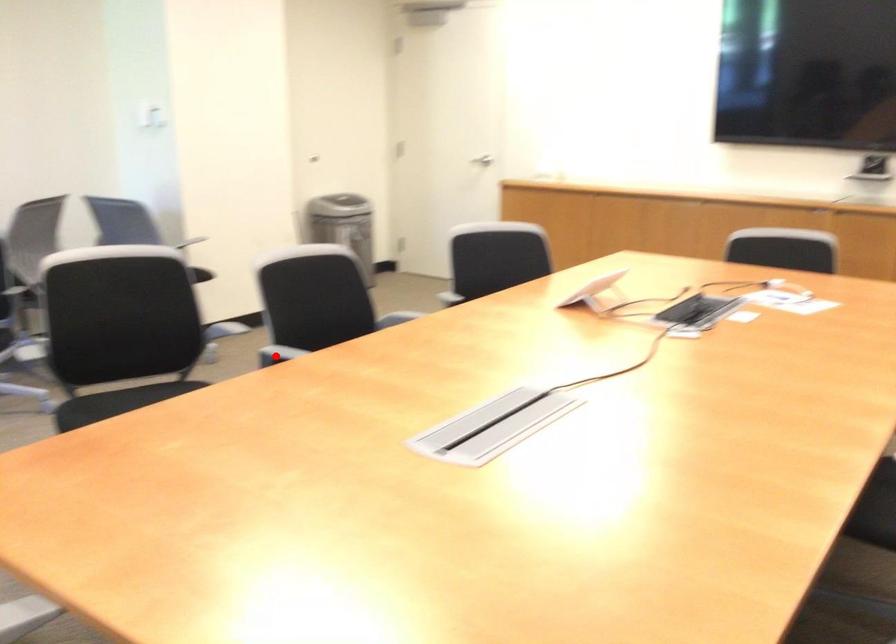
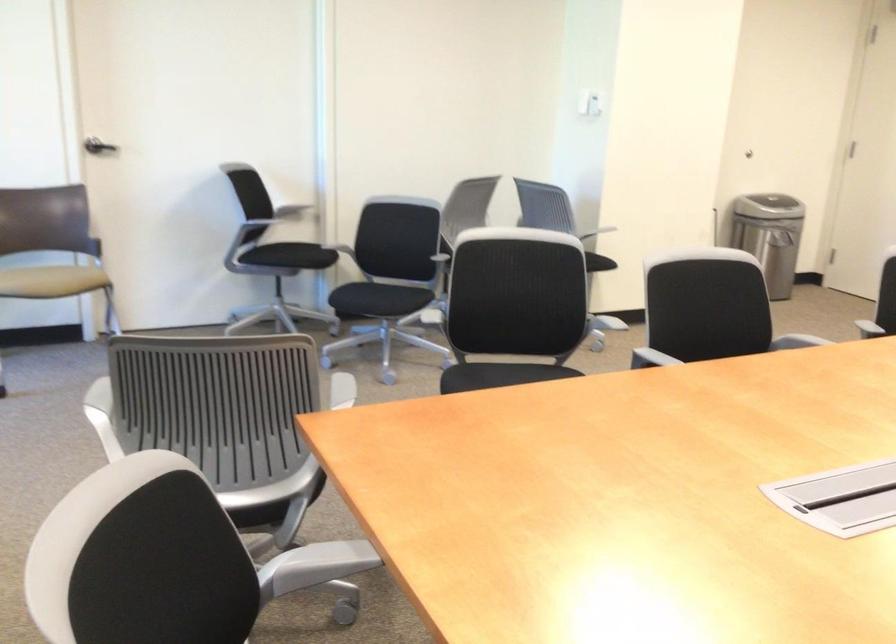
The point at the highlighted location is marked in the first image. Where is the corresponding point in the second image?

(650, 359)